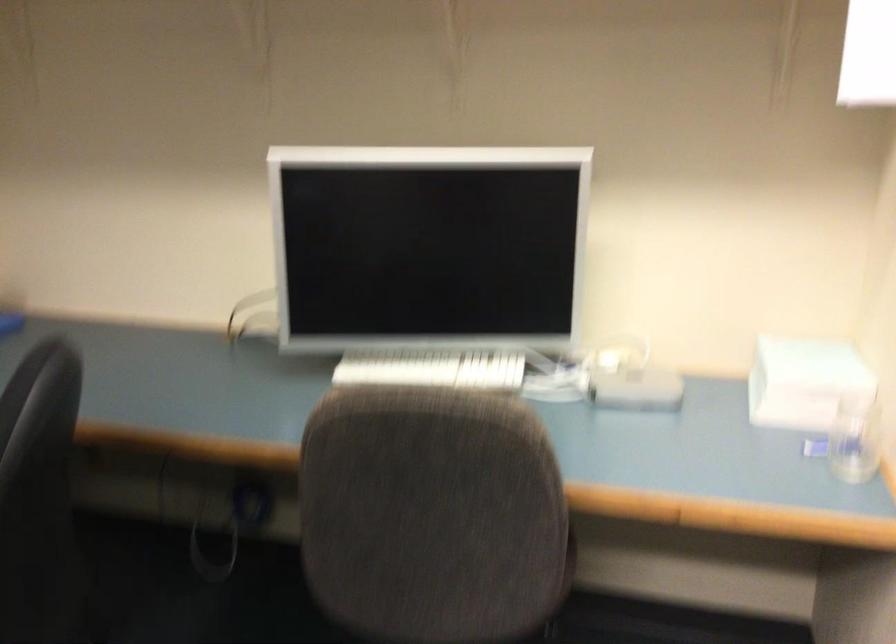
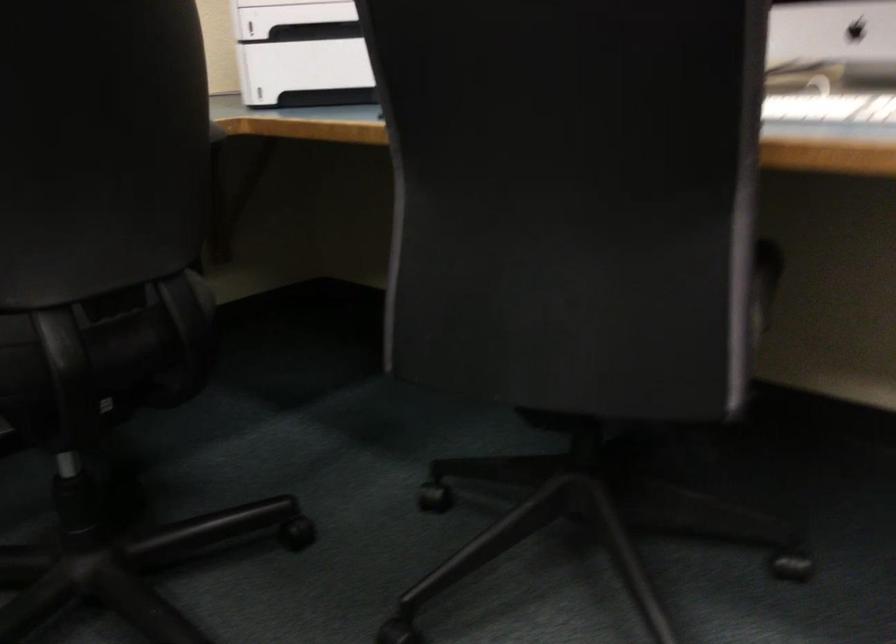
First-person continuous shooting, in which direction is the camera rotating?

The rotation direction of the camera is left-down.